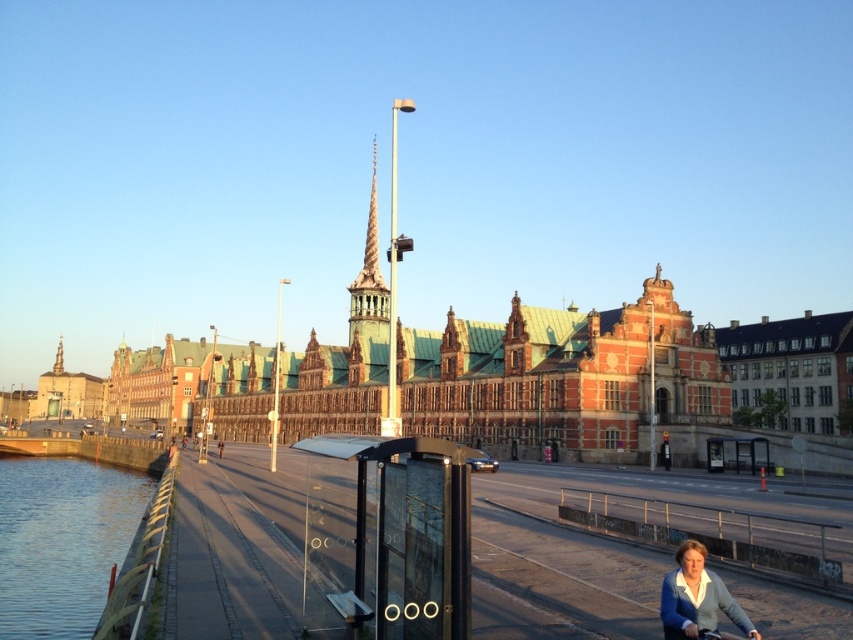
Between clear water at lower left and light brown sweater at lower right, which one is positioned lower?

clear water at lower left is lower down.

The image size is (853, 640). What do you see at coordinates (62, 541) in the screenshot? I see `clear water at lower left` at bounding box center [62, 541].

Which is in front, point (47, 461) or point (689, 552)?

Point (689, 552)

The height and width of the screenshot is (640, 853). I want to click on clear water at lower left, so click(x=62, y=541).

Who is more forward, (86, 625) or (720, 637)?

Point (720, 637) is more forward.

Which is more to the left, clear water at lower left or black matte bicycle at lower right?

From the viewer's perspective, clear water at lower left appears more on the left side.

Is point (27, 531) more distant than point (732, 637)?

That is True.

Find the location of a particular element. clear water at lower left is located at coordinates (62, 541).

Between point (665, 616) and point (700, 630), which one is positioned behind?

The point (665, 616) is behind.

Who is more distant from viewer, (672, 625) or (698, 632)?

The point (672, 625) is more distant.

I want to click on light brown sweater at lower right, so click(695, 596).